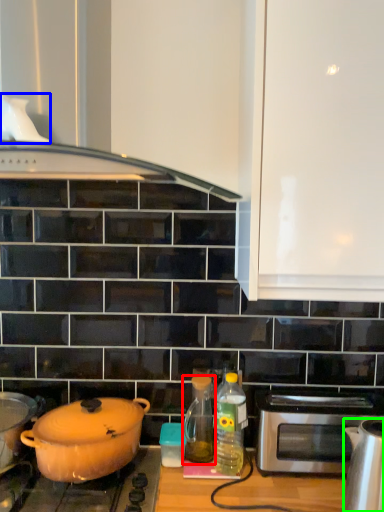
Question: Based on their relative distances, which object is farther from bottle (highlighted by a red box)? Choose from kitchen appliance (highlighted by a blue box) and kitchen appliance (highlighted by a green box).

Choices:
 (A) kitchen appliance
 (B) kitchen appliance

Answer: (A)